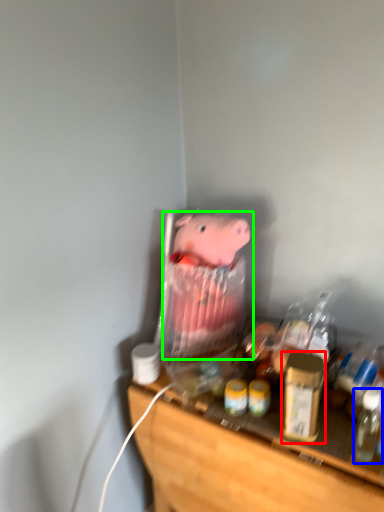
Question: Considering the real-world distances, which object is closest to beverage (highlighted by a red box)? bottle (highlighted by a blue box) or toy (highlighted by a green box).

Choices:
 (A) bottle
 (B) toy

Answer: (A)